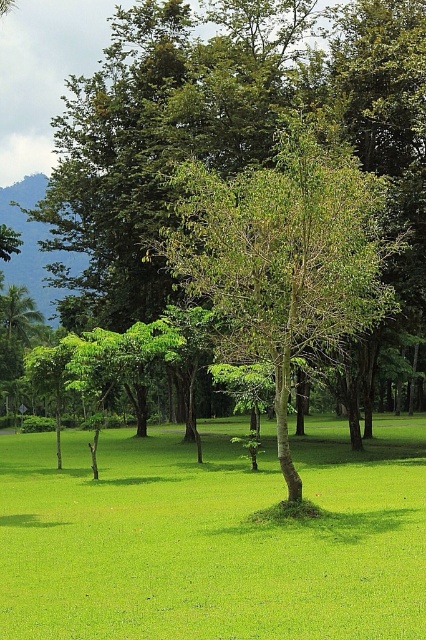
Question: Which point appears closest to the camera in this image?

Choices:
 (A) (209, 218)
 (B) (112, 436)

Answer: (A)

Question: Does green grass at center lie in front of green leafy tree at center?

Choices:
 (A) yes
 (B) no

Answer: (A)

Question: Can you confirm if green grass at center is positioned above green leafy tree at center?

Choices:
 (A) no
 (B) yes

Answer: (A)

Question: Does green grass at center appear over green leafy tree at center?

Choices:
 (A) yes
 (B) no

Answer: (B)

Question: Which point is farther from the camera taking this photo?

Choices:
 (A) (313, 333)
 (B) (400, 452)

Answer: (B)

Question: Which object is farther from the camera taking this photo?

Choices:
 (A) green grass at center
 (B) green leafy tree at center

Answer: (B)